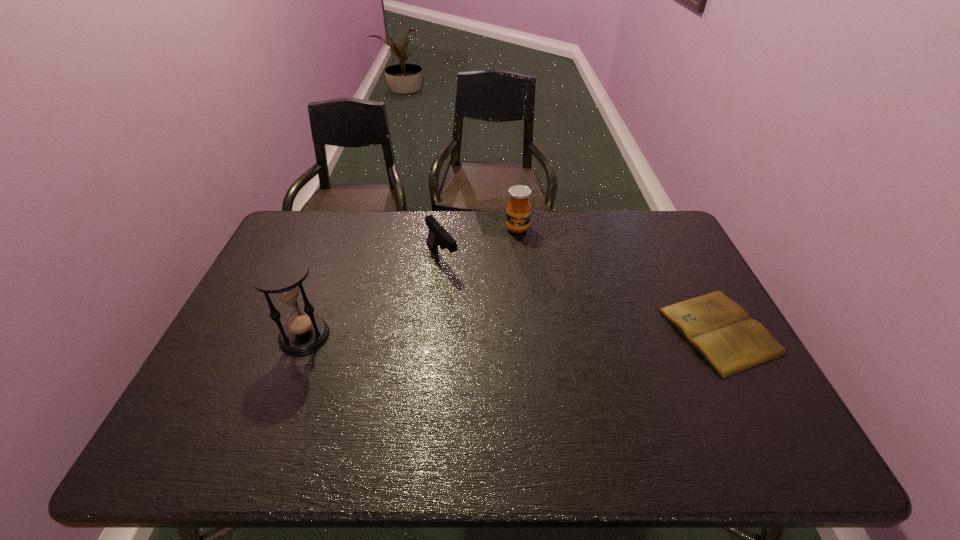
Where is `the tallest object`? the tallest object is located at coordinates (282, 275).

Find the location of a particular element. the leftmost object is located at coordinates (282, 275).

Where is `the shortest object`? This screenshot has width=960, height=540. the shortest object is located at coordinates (718, 328).

Identify the location of book. coord(718,328).

Where is `the third object from right to left`? This screenshot has width=960, height=540. the third object from right to left is located at coordinates (438, 236).

Identify the location of the second shortest object. The width and height of the screenshot is (960, 540). (438, 236).

I want to click on the farthest object, so click(x=518, y=214).

This screenshot has width=960, height=540. I want to click on honey, so click(518, 214).

Identify the location of vacant position located 0.070m on the front of the hourglass. (288, 378).

Find the location of a particular element. The image size is (960, 540). blank area located on the left of the rightmost object is located at coordinates (534, 330).